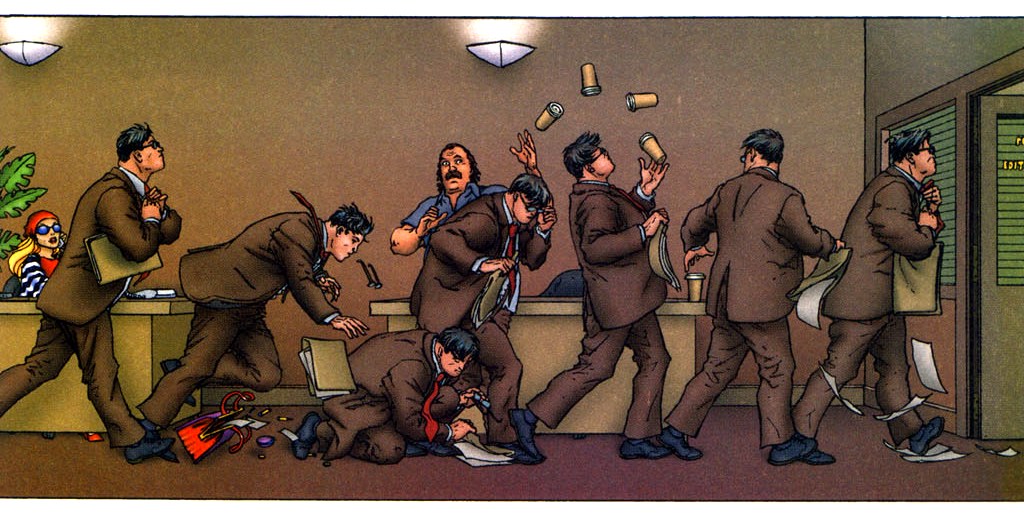
Locate an element on the screen. The width and height of the screenshot is (1024, 513). floor is located at coordinates (606, 482).